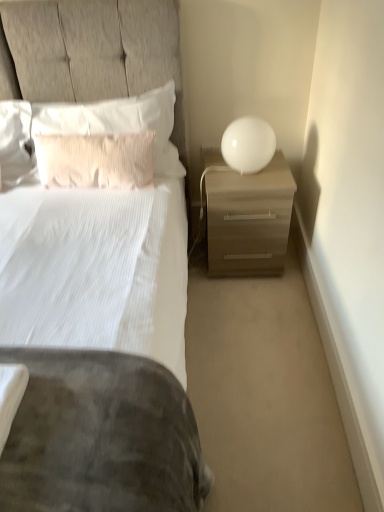
This screenshot has height=512, width=384. Identify the location of free point in front of matte wood nightstand at right. (248, 309).